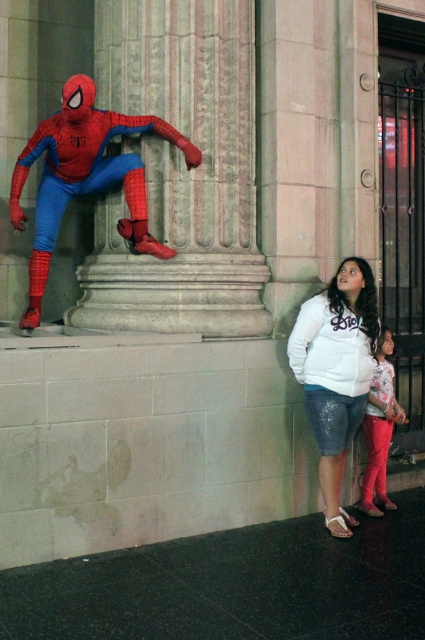
You are a photographer trying to capture the shiny spandex suit at center and the glittery leggings at lower right in the same frame. Which object should you focus on first if you want to include both in your shot?

You should focus on the shiny spandex suit at center first because it is positioned to the left of the glittery leggings at lower right, so adjusting the camera angle to include both would require starting with the leftmost object.

You are a photographer trying to capture the shiny spandex suit at center and the white sequined shorts at lower right in the same frame. Which object will appear larger in your photo?

The shiny spandex suit at center will appear larger in the photo because it is closer to the viewer than the white sequined shorts at lower right.